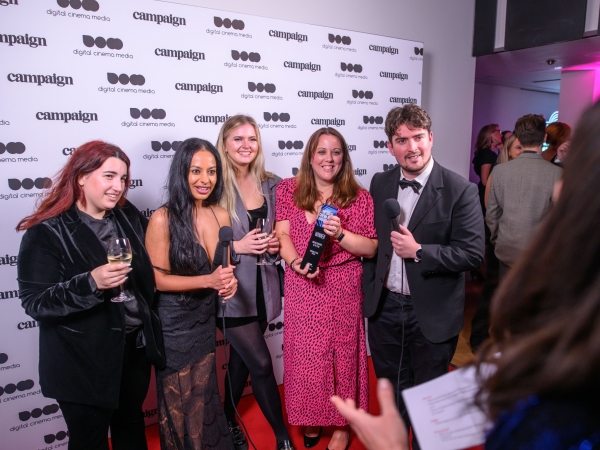
What are the coordinates of `purple light` in the screenshot? It's located at (592, 75).